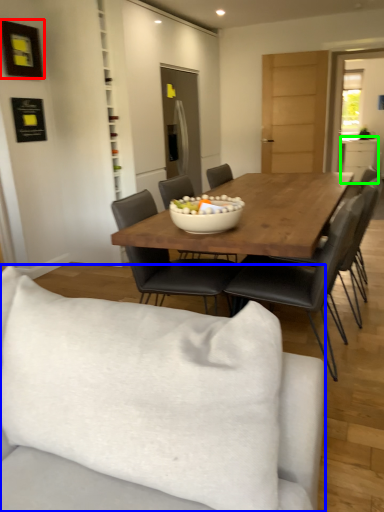
Question: Which object is positioned closest to picture frame (highlighted by a red box)? Select from studio couch (highlighted by a blue box) and cabinetry (highlighted by a green box).

Choices:
 (A) studio couch
 (B) cabinetry

Answer: (A)